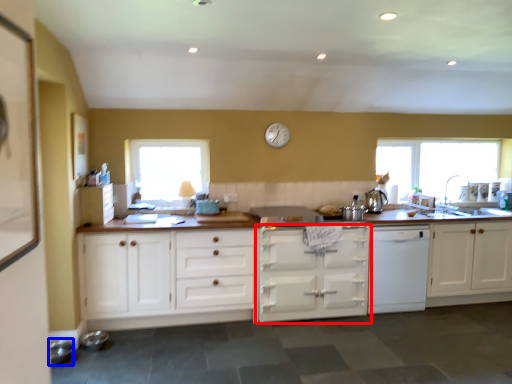
Question: Which point is closer to the camera, cabinetry (highlighted by a red box) or appliance (highlighted by a blue box)?

Choices:
 (A) cabinetry
 (B) appliance

Answer: (B)